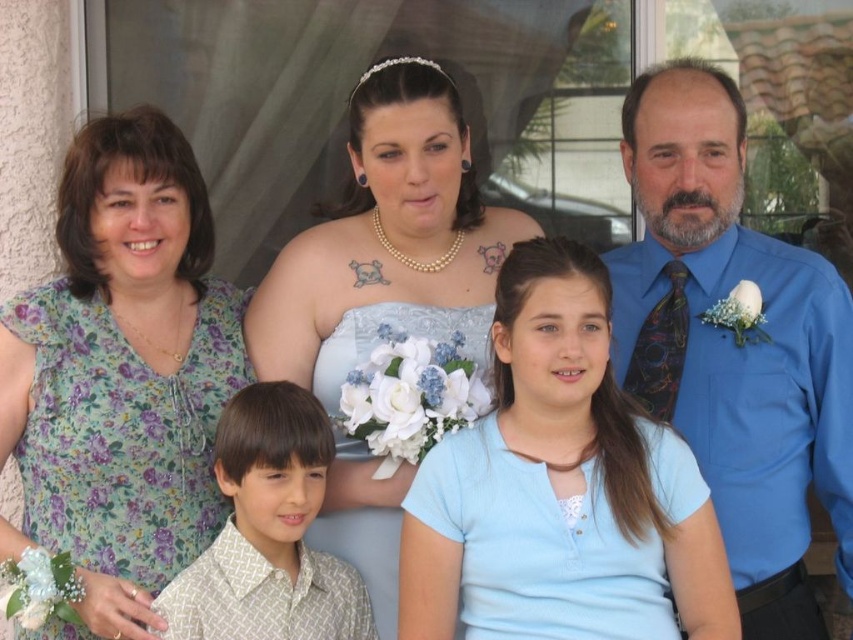
Question: From the image, what is the correct spatial relationship of light blue fabric at center in relation to pearl necklace at upper center?

Choices:
 (A) below
 (B) above

Answer: (A)

Question: In this image, where is light blue fabric at center located relative to white textured shirt at center?

Choices:
 (A) below
 (B) above

Answer: (B)

Question: Which object is farther from the camera taking this photo?

Choices:
 (A) green floral dress at left
 (B) blue silk shirt at right

Answer: (B)

Question: Which of the following is the closest to the observer?

Choices:
 (A) pearl necklace at upper center
 (B) blue silk shirt at right
 (C) white textured shirt at center
 (D) light blue fabric at center

Answer: (D)

Question: Is green floral dress at left below pearl necklace at upper center?

Choices:
 (A) no
 (B) yes

Answer: (B)

Question: Which object is closer to the camera taking this photo?

Choices:
 (A) pearl necklace at upper center
 (B) blue silk shirt at right

Answer: (B)